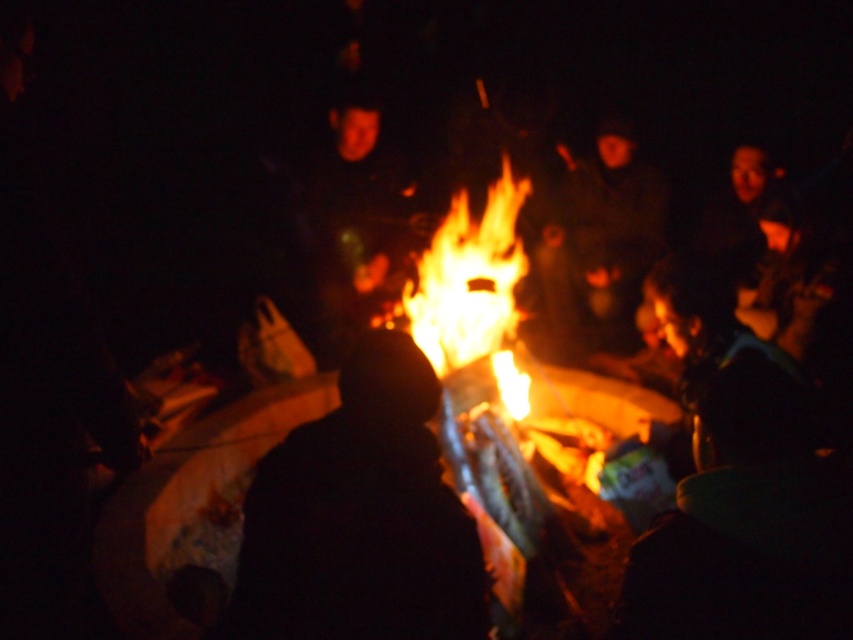
You are standing in the campfire scene and want to place a small decorative item between the two points, point (x=248, y=563) and point (x=450, y=205). Which point should you place it closer to in order for it to appear larger to someone looking at the scene?

You should place the item closer to point (x=248, y=563) because it is closer to the viewer than point (x=450, y=205). Objects placed closer to the viewer appear larger in the scene.

You are standing at the origin point in the image and want to walk directly to the black matte person at center. What are the coordinates you need to move towards?

The coordinates to move towards are 0.809 in the x direction and 0.423 in the y direction.

You are standing at the edge of the campfire scene. There is a point marked at coordinates (360, 516). Which object in the scene does this point lie on?

The point at coordinates (360, 516) lies on the black matte person at center.